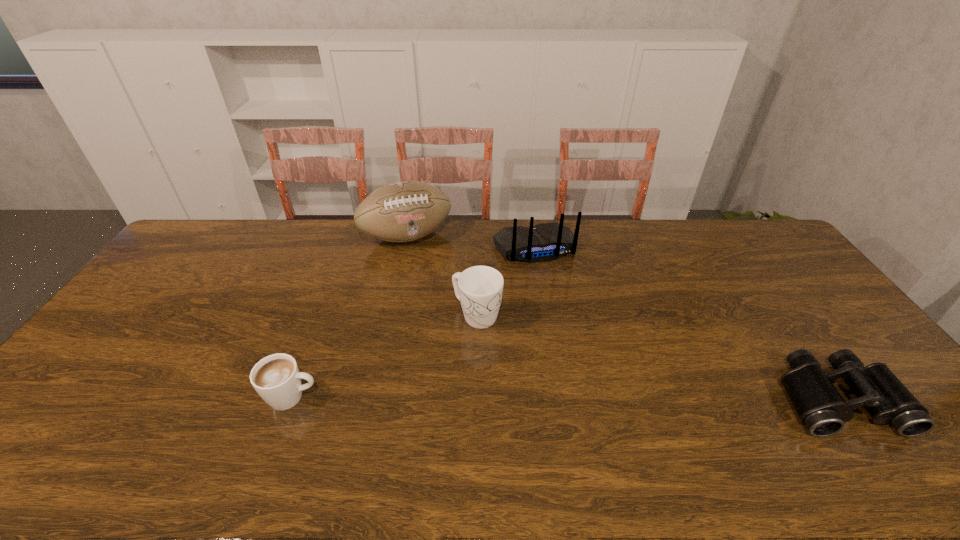
I want to click on object present at the right edge, so click(x=820, y=407).

At what (x,y) coordinates should I click in order to perform the action: click on object located at the near right corner. Please return your answer as a coordinate pair (x, y). Looking at the image, I should click on (820, 407).

Where is `free location at the far edge`? free location at the far edge is located at coordinates (695, 235).

Where is `free space at the near edge of the desktop`? free space at the near edge of the desktop is located at coordinates (228, 431).

Find the location of `free location at the left edge`. free location at the left edge is located at coordinates (140, 341).

Find the location of a particular element. The width and height of the screenshot is (960, 540). vacant space at the right edge of the desktop is located at coordinates (839, 387).

Locate an element on the screen. vacant space at the far right corner of the desktop is located at coordinates (755, 246).

Image resolution: width=960 pixels, height=540 pixels. In order to click on free space between the football (American) and the rightmost object in this screenshot , I will do `click(621, 318)`.

The width and height of the screenshot is (960, 540). In order to click on vacant space in between the football (American) and the binoculars in this screenshot , I will do click(621, 318).

You are a GUI agent. You are given a task and a screenshot of the screen. Output one action in this format:
    pyautogui.click(x=<x>, y=<y>)
    Task: Click on the free space between the mug and the router
    This screenshot has width=960, height=540.
    Given the screenshot: What is the action you would take?
    point(505,282)